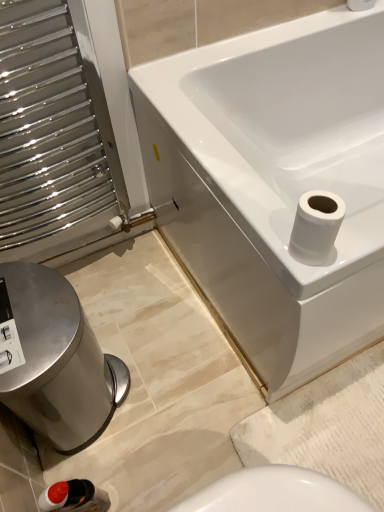
Identify the location of polished stainless steel bidet at lower left. This screenshot has width=384, height=512. (55, 359).

Find the location of a particular element. The image size is (384, 512). matte black bottle at lower left is located at coordinates (74, 497).

The width and height of the screenshot is (384, 512). In order to click on polished stainless steel bidet at lower left in this screenshot , I will do `click(55, 359)`.

In the scene shown: From a real-world perspective, is white glossy bathtub at upper right located higher than polished stainless steel bidet at lower left?

Yes.

This screenshot has width=384, height=512. I want to click on bathtub in front of the polished stainless steel bidet at lower left, so click(274, 182).

Is white glossy bathtub at upper right facing towards polished stainless steel bidet at lower left?

No, white glossy bathtub at upper right is not oriented towards polished stainless steel bidet at lower left.

From the image's perspective, is white glossy bathtub at upper right under polished stainless steel bidet at lower left?

Incorrect, from the image's perspective, white glossy bathtub at upper right is higher than polished stainless steel bidet at lower left.

Does white glossy toilet paper at upper right, which is counted as the first toilet paper, starting from the left, turn towards white glossy bathtub at upper right?

No, white glossy toilet paper at upper right, which is counted as the first toilet paper, starting from the left, is not oriented towards white glossy bathtub at upper right.

Which object is more forward, white glossy toilet paper at upper right, which is the 2th toilet paper from top to bottom, or white glossy bathtub at upper right?

white glossy toilet paper at upper right, which is the 2th toilet paper from top to bottom, is in front.

Between white glossy toilet paper at upper right, the first toilet paper when ordered from bottom to top, and white glossy bathtub at upper right, which one has smaller size?

white glossy toilet paper at upper right, the first toilet paper when ordered from bottom to top, is smaller.

From the image's perspective, is matte black bottle at lower left below white matte toilet paper at upper right, which is counted as the 2th toilet paper, starting from the front?

Yes.

Choose the correct answer: Is matte black bottle at lower left inside white matte toilet paper at upper right, the second toilet paper in the left-to-right sequence, or outside it?

matte black bottle at lower left cannot be found inside white matte toilet paper at upper right, the second toilet paper in the left-to-right sequence.

Considering the sizes of matte black bottle at lower left and white matte toilet paper at upper right, the first toilet paper in the top-to-bottom sequence, in the image, is matte black bottle at lower left taller or shorter than white matte toilet paper at upper right, the first toilet paper in the top-to-bottom sequence,?

matte black bottle at lower left is taller than white matte toilet paper at upper right, the first toilet paper in the top-to-bottom sequence.

How many degrees apart are the facing directions of matte black bottle at lower left and white matte toilet paper at upper right, the second toilet paper in the left-to-right sequence?

91.8 degrees.

Based on the photo, is white matte toilet paper at upper right, which is the first toilet paper from back to front, outside of matte black bottle at lower left?

Yes, white matte toilet paper at upper right, which is the first toilet paper from back to front, is outside of matte black bottle at lower left.

From a real-world perspective, who is located lower, white matte toilet paper at upper right, which is counted as the 2th toilet paper, starting from the front, or matte black bottle at lower left?

In real-world perspective, matte black bottle at lower left is lower.

Does white matte toilet paper at upper right, the first toilet paper in the top-to-bottom sequence, have a larger size compared to matte black bottle at lower left?

Incorrect, white matte toilet paper at upper right, the first toilet paper in the top-to-bottom sequence, is not larger than matte black bottle at lower left.

Is white matte toilet paper at upper right, which is counted as the 2th toilet paper, starting from the front, oriented towards matte black bottle at lower left?

No, white matte toilet paper at upper right, which is counted as the 2th toilet paper, starting from the front, is not aimed at matte black bottle at lower left.

How many degrees apart are the facing directions of white matte toilet paper at upper right, which is the first toilet paper from back to front, and white glossy bathtub at upper right?

The angle between the facing direction of white matte toilet paper at upper right, which is the first toilet paper from back to front, and the facing direction of white glossy bathtub at upper right is 1.03 degrees.

From the image's perspective, is white matte toilet paper at upper right, which is the first toilet paper from back to front, positioned above or below white glossy bathtub at upper right?

Clearly, from the image's perspective, white matte toilet paper at upper right, which is the first toilet paper from back to front, is above white glossy bathtub at upper right.

Between white matte toilet paper at upper right, the first toilet paper in the top-to-bottom sequence, and white glossy bathtub at upper right, which one is positioned in front?

white glossy bathtub at upper right.

Would you consider matte black bottle at lower left to be distant from white glossy bathtub at upper right?

matte black bottle at lower left is actually quite close to white glossy bathtub at upper right.

Is matte black bottle at lower left outside of white glossy bathtub at upper right?

matte black bottle at lower left is positioned outside white glossy bathtub at upper right.

Is matte black bottle at lower left oriented away from white glossy bathtub at upper right?

No, matte black bottle at lower left's orientation is not away from white glossy bathtub at upper right.

Considering the points (87, 481) and (292, 84), which point is behind, point (87, 481) or point (292, 84)?

Positioned behind is point (292, 84).

Image resolution: width=384 pixels, height=512 pixels. What are the coordinates of `bidet that is above the matte black bottle at lower left (from the image's perspective)` in the screenshot? It's located at (55, 359).

Does point (76, 501) appear closer or farther from the camera than point (45, 407)?

Point (76, 501) is positioned closer to the camera compared to point (45, 407).

Is matte black bottle at lower left inside the boundaries of polished stainless steel bidet at lower left, or outside?

matte black bottle at lower left is spatially situated outside polished stainless steel bidet at lower left.

Find the location of a particular element. Image resolution: width=384 pixels, height=512 pixels. bidet below the white glossy bathtub at upper right (from a real-world perspective) is located at coordinates (55, 359).

Starting from the white glossy bathtub at upper right, which toilet paper is the 2nd one to the left? Please provide its 2D coordinates.

[(316, 226)]

Considering their positions, is matte black bottle at lower left positioned closer to white matte toilet paper at upper right, which is the first toilet paper from back to front, than polished stainless steel bidet at lower left?

The object closer to white matte toilet paper at upper right, which is the first toilet paper from back to front, is polished stainless steel bidet at lower left.

Looking at the image, which one is located closer to white matte toilet paper at upper right, which is the first toilet paper from back to front, matte black bottle at lower left or white glossy bathtub at upper right?

white glossy bathtub at upper right.

Looking at the image, which one is located further to matte black bottle at lower left, white matte toilet paper at upper right, marked as the 2th toilet paper in a bottom-to-top arrangement, or polished stainless steel bidet at lower left?

white matte toilet paper at upper right, marked as the 2th toilet paper in a bottom-to-top arrangement, is further to matte black bottle at lower left.

Looking at the image, which one is located further to white glossy bathtub at upper right, matte black bottle at lower left or white glossy toilet paper at upper right, the 2th toilet paper from the right?

matte black bottle at lower left lies further to white glossy bathtub at upper right than the other object.

Which object lies nearer to the anchor point white glossy bathtub at upper right, white glossy toilet paper at upper right, the 2th toilet paper from the right, or polished stainless steel bidet at lower left?

white glossy toilet paper at upper right, the 2th toilet paper from the right, lies closer to white glossy bathtub at upper right than the other object.

From the image, which object appears to be farther from white matte toilet paper at upper right, which is the first toilet paper from back to front, white glossy toilet paper at upper right, which is the 2th toilet paper from top to bottom, or matte black bottle at lower left?

matte black bottle at lower left.

Based on their spatial positions, is white glossy bathtub at upper right or white matte toilet paper at upper right, which ranks as the first toilet paper in right-to-left order, further from polished stainless steel bidet at lower left?

white matte toilet paper at upper right, which ranks as the first toilet paper in right-to-left order.

Looking at the image, which one is located closer to white glossy toilet paper at upper right, the second toilet paper viewed from the back, matte black bottle at lower left or polished stainless steel bidet at lower left?

polished stainless steel bidet at lower left is positioned closer to the anchor white glossy toilet paper at upper right, the second toilet paper viewed from the back.

Where is `toilet paper between white matte toilet paper at upper right, which is the first toilet paper from back to front, and matte black bottle at lower left vertically`? Image resolution: width=384 pixels, height=512 pixels. toilet paper between white matte toilet paper at upper right, which is the first toilet paper from back to front, and matte black bottle at lower left vertically is located at coordinates (316, 226).

Find the location of `toilet paper between white glossy bathtub at upper right and matte black bottle at lower left vertically`. toilet paper between white glossy bathtub at upper right and matte black bottle at lower left vertically is located at coordinates (316, 226).

I want to click on bathtub between white matte toilet paper at upper right, which is the first toilet paper from back to front, and matte black bottle at lower left vertically, so click(x=274, y=182).

The height and width of the screenshot is (512, 384). Identify the location of plumbing fixture between polished stainless steel bidet at lower left and white glossy bathtub at upper right from left to right. (74, 497).